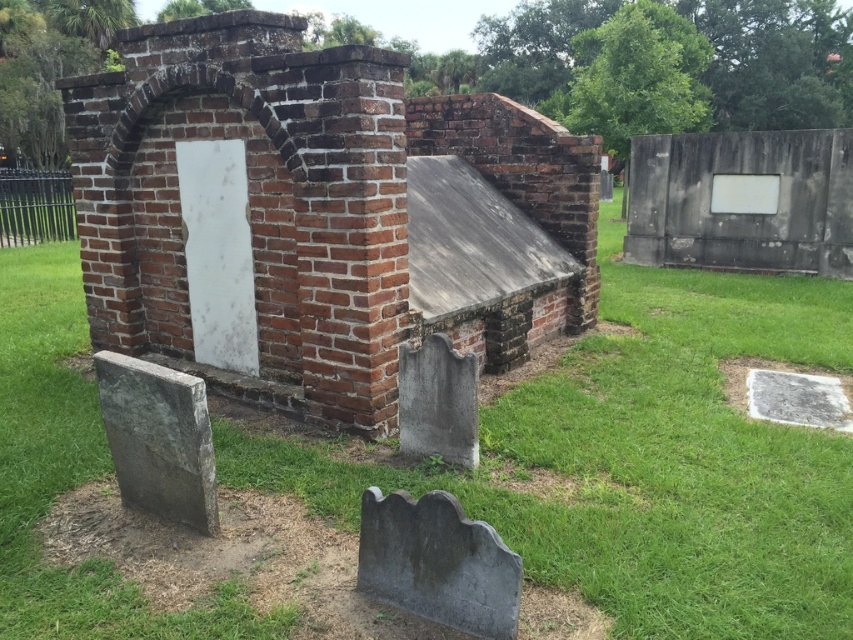
You are a groundskeeper tasked with mowing the lawn in the cemetery. You see the green grass at center and the gray stone gravestone at center. Which area should you avoid mowing to prevent damaging any objects?

You should avoid mowing around the gray stone gravestone at center because the green grass at center is larger in size and more suitable for mowing without damaging the gravestone.

You are a groundskeeper in the cemetery and need to access the gray stone gravestone at lower center. However, the gray stone gravestone at center is blocking your path. Can you reach it without moving the center gravestone?

The gray stone gravestone at lower center is positioned under the gray stone gravestone at center, so you cannot reach it without moving the center gravestone.